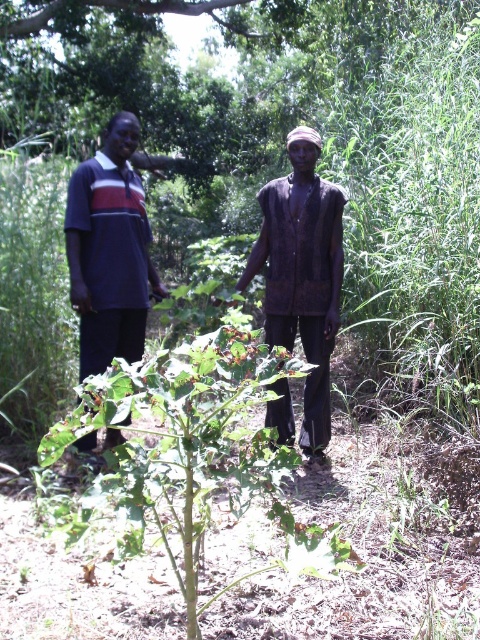
You are a photographer trying to capture a photo of the green leafy plant at center without the dark blue jersey at left blocking it. Based on their heights, can you suggest a way to position yourself to avoid the jersey blocking the view?

Since the green leafy plant at center is not as tall as the dark blue jersey at left, you can kneel down or move closer to the ground to lower your viewpoint, allowing you to see the plant without the jersey blocking it.

You are a photographer trying to capture a closeup of the green leafy plant at center and dark brown fabric at center. Which object should you focus on first if you want to ensure both are in focus without moving the camera?

You should focus on the green leafy plant at center first since it is larger than the dark brown fabric at center, allowing for a greater depth of field to include both in focus.